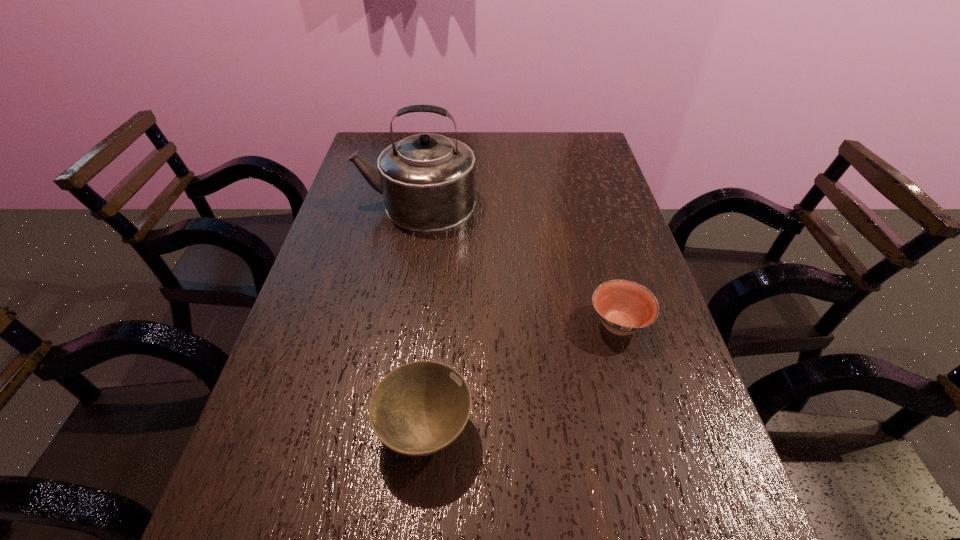
At what (x,y) coordinates should I click in order to perform the action: click on kettle. Please return your answer as a coordinate pair (x, y). The width and height of the screenshot is (960, 540). Looking at the image, I should click on (427, 180).

Where is `the tallest object`? The width and height of the screenshot is (960, 540). the tallest object is located at coordinates (427, 180).

The width and height of the screenshot is (960, 540). Find the location of `the second tallest object`. the second tallest object is located at coordinates click(x=419, y=408).

You are a GUI agent. You are given a task and a screenshot of the screen. Output one action in this format:
    pyautogui.click(x=<x>, y=<y>)
    Task: Click on the left bowl
    
    Given the screenshot: What is the action you would take?
    pyautogui.click(x=419, y=408)

Where is `the rightmost object`? the rightmost object is located at coordinates (624, 307).

Locate an element on the screen. The image size is (960, 540). the second nearest object is located at coordinates (624, 307).

Image resolution: width=960 pixels, height=540 pixels. In order to click on blank space located on the left of the taller bowl in this screenshot , I will do `click(323, 429)`.

Identify the location of free region located on the front of the shortest object. The width and height of the screenshot is (960, 540). (676, 530).

You are a GUI agent. You are given a task and a screenshot of the screen. Output one action in this format:
    pyautogui.click(x=<x>, y=<y>)
    Task: Click on the object located at the left edge
    This screenshot has width=960, height=540.
    Given the screenshot: What is the action you would take?
    pyautogui.click(x=427, y=180)

Image resolution: width=960 pixels, height=540 pixels. I want to click on object at the right edge, so tap(624, 307).